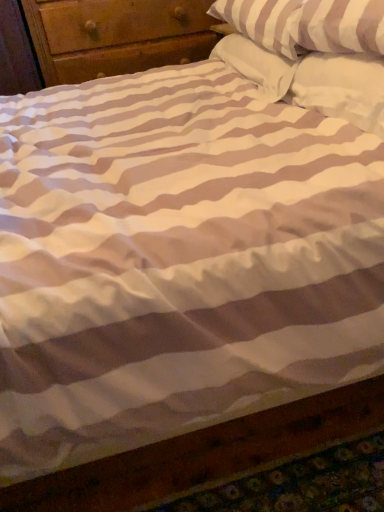
Question: Should I look upward or downward to see white soft pillow at upper right, the first pillow when ordered from front to back?

Choices:
 (A) down
 (B) up

Answer: (B)

Question: Can you confirm if white soft pillow at upper right, the first pillow when ordered from front to back, is taller than white soft pillow at upper right, the 3th pillow viewed from the front?

Choices:
 (A) no
 (B) yes

Answer: (B)

Question: Does white soft pillow at upper right, the first pillow when ordered from front to back, have a lesser width compared to white soft pillow at upper right, the 3th pillow viewed from the front?

Choices:
 (A) yes
 (B) no

Answer: (A)

Question: Is white soft pillow at upper right, the first pillow when ordered from front to back, oriented away from white soft pillow at upper right, the 3th pillow viewed from the front?

Choices:
 (A) no
 (B) yes

Answer: (A)

Question: From a real-world perspective, is white soft pillow at upper right, the first pillow when ordered from front to back, positioned under white soft pillow at upper right, the 3th pillow viewed from the front, based on gravity?

Choices:
 (A) yes
 (B) no

Answer: (B)

Question: Considering the relative sizes of white soft pillow at upper right, the first pillow when ordered from front to back, and white soft pillow at upper right, the 3th pillow viewed from the front, in the image provided, is white soft pillow at upper right, the first pillow when ordered from front to back, smaller than white soft pillow at upper right, the 3th pillow viewed from the front,?

Choices:
 (A) no
 (B) yes

Answer: (B)

Question: Does white soft pillow at upper right, the first pillow when ordered from front to back, appear on the left side of white soft pillow at upper right, the 3th pillow viewed from the front?

Choices:
 (A) yes
 (B) no

Answer: (B)

Question: Considering the relative sizes of white striped pillow at upper right, which is counted as the second pillow, starting from the back, and white soft pillow at upper right, the 3th pillow in the back-to-front sequence, in the image provided, is white striped pillow at upper right, which is counted as the second pillow, starting from the back, taller than white soft pillow at upper right, the 3th pillow in the back-to-front sequence,?

Choices:
 (A) yes
 (B) no

Answer: (A)

Question: Is white striped pillow at upper right, the 2th pillow viewed from the front, further to the viewer compared to white soft pillow at upper right, the 3th pillow in the back-to-front sequence?

Choices:
 (A) no
 (B) yes

Answer: (B)

Question: Is white striped pillow at upper right, the 2th pillow viewed from the front, outside of white soft pillow at upper right, the 3th pillow in the back-to-front sequence?

Choices:
 (A) no
 (B) yes

Answer: (B)

Question: From a real-world perspective, is white striped pillow at upper right, which is counted as the second pillow, starting from the back, physically above white soft pillow at upper right, the first pillow when ordered from front to back?

Choices:
 (A) no
 (B) yes

Answer: (B)

Question: Is white soft pillow at upper right, the first pillow when ordered from front to back, at the back of white striped pillow at upper right, which is counted as the second pillow, starting from the back?

Choices:
 (A) no
 (B) yes

Answer: (A)

Question: Does white striped pillow at upper right, which is counted as the second pillow, starting from the back, lie in front of white soft pillow at upper right, the 3th pillow in the back-to-front sequence?

Choices:
 (A) yes
 (B) no

Answer: (B)

Question: Is white striped pillow at upper right, which is counted as the second pillow, starting from the back, positioned in front of white soft pillow at upper right, the 3th pillow viewed from the front?

Choices:
 (A) no
 (B) yes

Answer: (B)